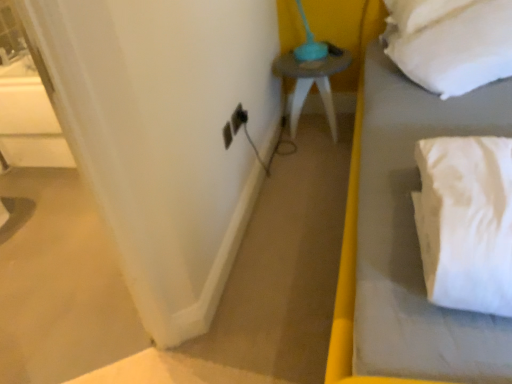
Identify the location of vacant area in front of matte gray side table at center. (307, 165).